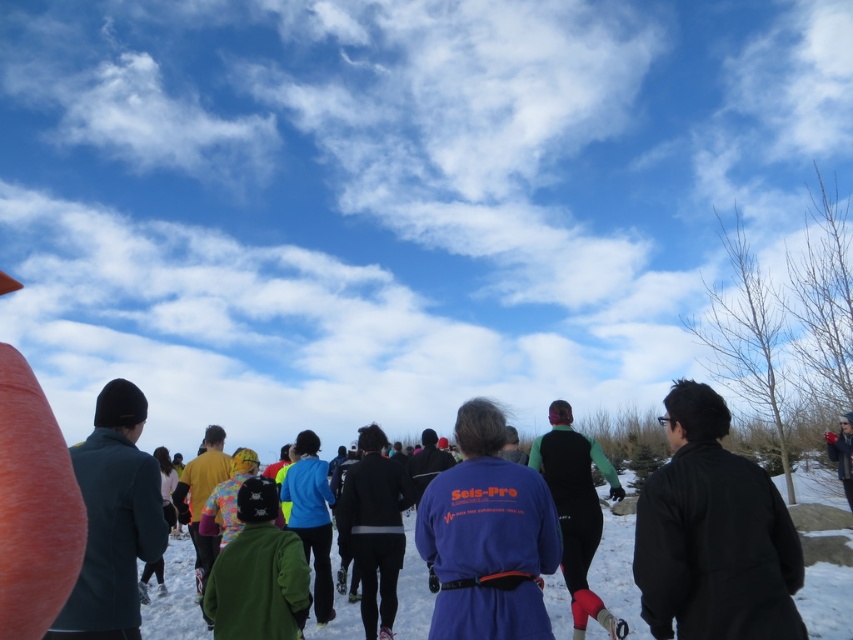
Is point (531, 488) positioned after point (412, 609)?

No, it is not.

From the picture: Between blue fleece jacket at center and white powdery snow at center, which one is positioned higher?

blue fleece jacket at center

You are a GUI agent. You are given a task and a screenshot of the screen. Output one action in this format:
    pyautogui.click(x=<x>, y=<y>)
    Task: Click on the blue fleece jacket at center
    
    Given the screenshot: What is the action you would take?
    pyautogui.click(x=486, y=536)

Where is `blue fleece jacket at center`? The height and width of the screenshot is (640, 853). blue fleece jacket at center is located at coordinates (486, 536).

Can you confirm if black matte jacket at right is positioned above white powdery snow at center?

Yes, black matte jacket at right is above white powdery snow at center.

Who is higher up, black matte jacket at right or white powdery snow at center?

black matte jacket at right is above.

Is point (643, 524) closer to camera compared to point (415, 627)?

Yes, it is.

This screenshot has height=640, width=853. Identify the location of black matte jacket at right. (712, 534).

Based on the photo, who is shorter, black matte jacket at right or blue fleece jacket at center?

blue fleece jacket at center is shorter.

Does point (775, 561) come in front of point (457, 529)?

Yes, it is in front of point (457, 529).

What are the coordinates of `black matte jacket at right` in the screenshot? It's located at (712, 534).